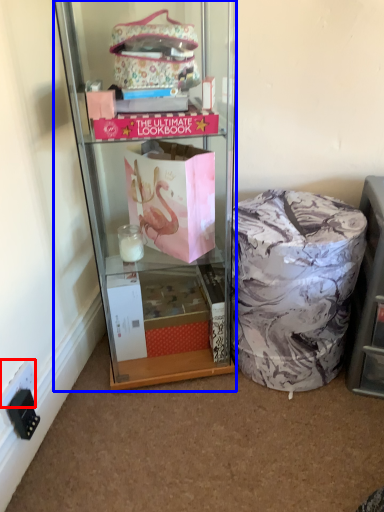
Question: Which point is closer to the camera, power outlet (highlighted by a red box) or cabinetry (highlighted by a blue box)?

Choices:
 (A) power outlet
 (B) cabinetry

Answer: (B)